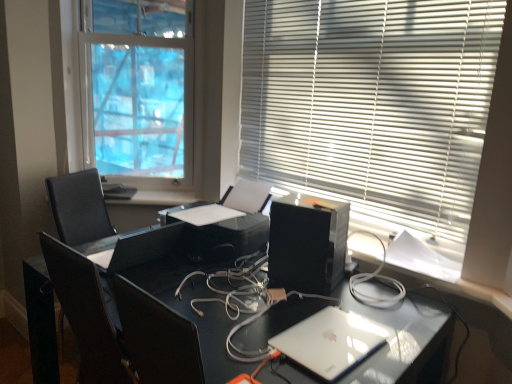
Where is `free space in front of black plastic desktop computer at center`? The image size is (512, 384). free space in front of black plastic desktop computer at center is located at coordinates (304, 302).